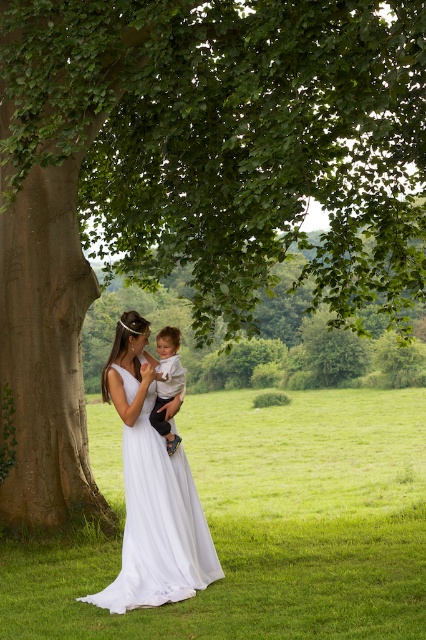
You are a photographer setting up for a photoshoot. You have a camera with a 24 inch lens. You need to capture both the white chiffon dress at center and the white cotton shirt at center in the same frame. Can you position yourself close enough to include both without moving the subjects? Please explain your reasoning.

The white chiffon dress at center is 24.96 inches from the white cotton shirt at center. Since the distance between them is slightly more than 24 inches, the camera lens might struggle to capture both in the same frame without moving closer or adjusting the angle. However, depending on the lens focal length and camera positioning, it could be possible with careful framing. The photographer should test the setup to ensure both subjects are within the shot.

You are a photographer trying to position a subject in the exact center of the frame. You see the white chiffon dress at center in the image. Is the dress already positioned at the center of the frame?

The white chiffon dress at center is located at the 2D coordinates point (158, 524), which is not the exact center of the frame. The center would be at coordinates (213, 320). Therefore, the dress is not centered.

You are standing at the origin point in the scene and want to walk towards the two points labeled as point (204, 582) and point (166, 380). Which point will you reach first?

You will reach point (166, 380) first because it is closer to you than point (204, 582), which is further away.